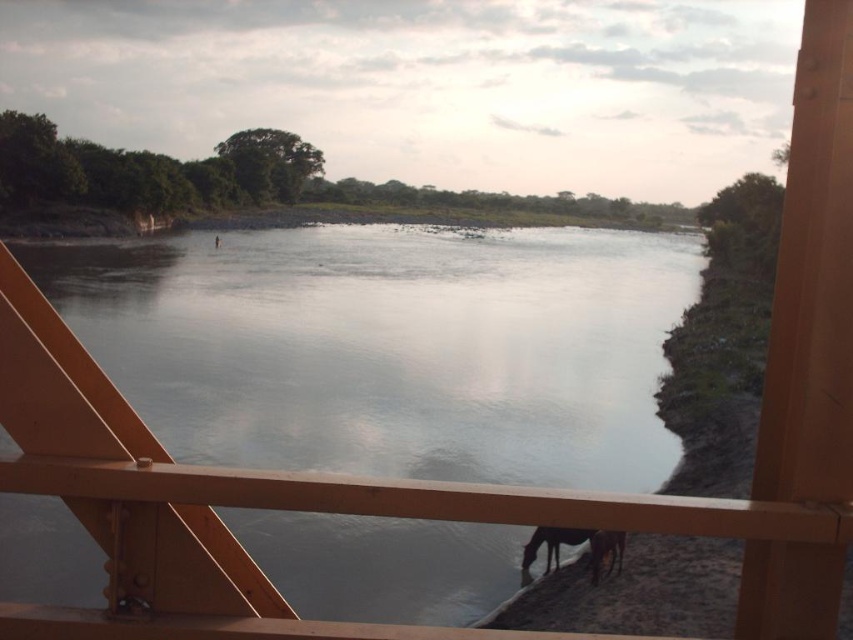
Question: Is dark brown fur horse at lower right positioned before white glossy horse at lower right?

Choices:
 (A) yes
 (B) no

Answer: (A)

Question: Which of the following is the farthest from the observer?

Choices:
 (A) (548, 541)
 (B) (495, 596)
 (C) (611, 534)

Answer: (A)

Question: Is dark brown fur horse at lower right in front of white glossy horse at lower right?

Choices:
 (A) no
 (B) yes

Answer: (B)

Question: Which of the following is the farthest from the observer?

Choices:
 (A) smooth water at center
 (B) white glossy horse at lower right

Answer: (B)

Question: Which point is closer to the camera?

Choices:
 (A) white glossy horse at lower right
 (B) smooth water at center
 (C) dark brown fur horse at lower right

Answer: (C)

Question: Does smooth water at center appear under dark brown fur horse at lower right?

Choices:
 (A) yes
 (B) no

Answer: (B)